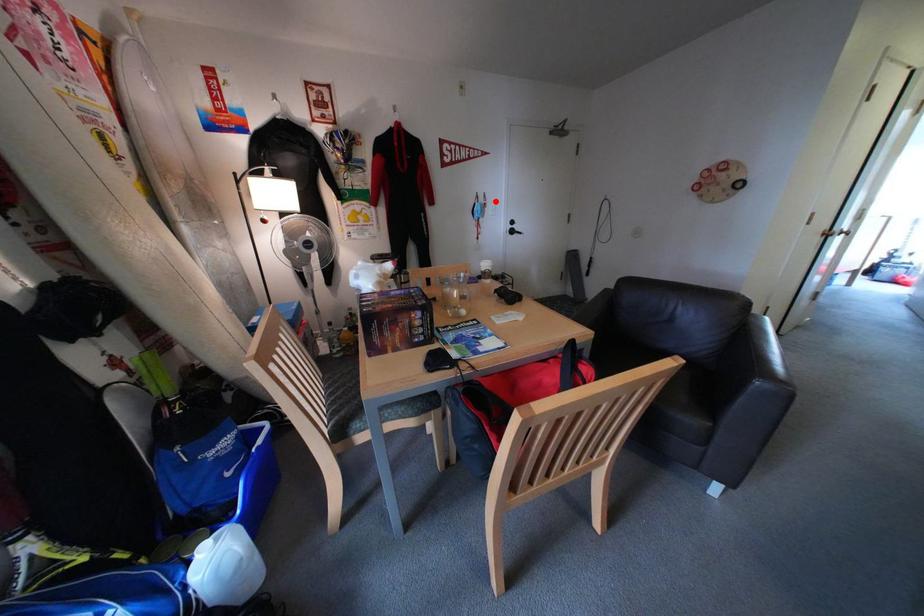
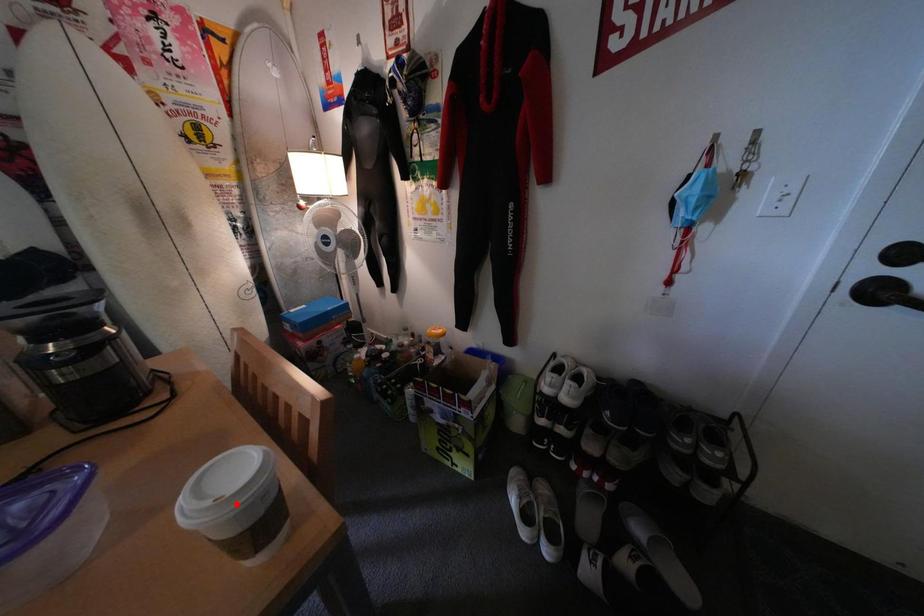
I am providing you with two images of the same scene from different viewpoints. A red point is marked on the first image and another point is marked on the second image. Is the red point in image1 aligned with the point shown in image2?

No